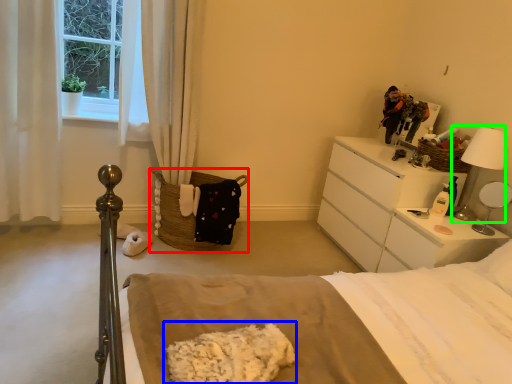
Question: Which is farther away from basket (highlighted by a red box)? material (highlighted by a blue box) or table lamp (highlighted by a green box)?

Choices:
 (A) material
 (B) table lamp

Answer: (B)